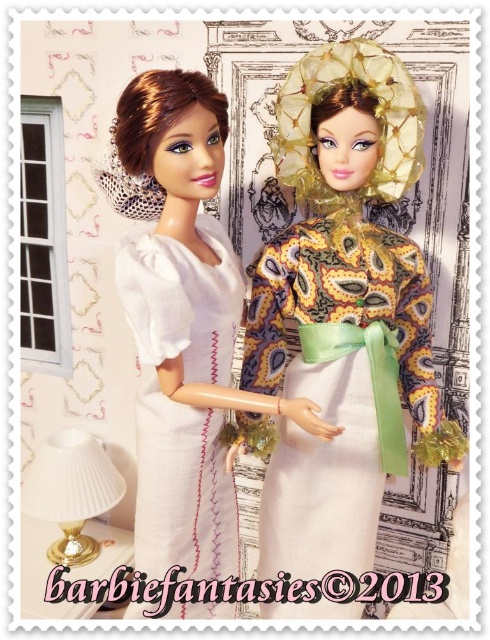
What are the coordinates of the matte green fabric dress at center?

The matte green fabric dress at center is located at point (x=343, y=310).

Based on the photo, you are a fashion designer observing two dolls in an indoor setting. The dolls are wearing the matte green fabric dress at center and the white linen dress at left. Which dress is closer to the front of the scene?

The matte green fabric dress at center is closer to the front because the white linen dress at left is positioned behind it.

You are a photographer setting up a shoot in the room where the matte green fabric dress at center and the white pleated lampshade at lower left are located. You want to focus on the dress while keeping the lampshade in the background. Which object should be placed closer to the camera?

The matte green fabric dress at center should be placed closer to the camera since it is closer to the viewer than the white pleated lampshade at lower left, ensuring it remains the focal point while the lampshade stays in the background.